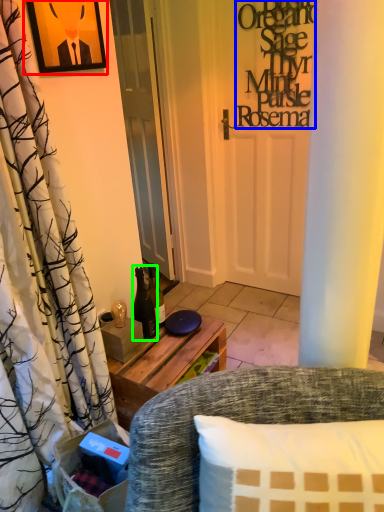
Question: Estimate the real-world distances between objects in this image. Which object is closer to picture frame (highlighted by a red box), writing (highlighted by a blue box) or bottle (highlighted by a green box)?

Choices:
 (A) writing
 (B) bottle

Answer: (B)